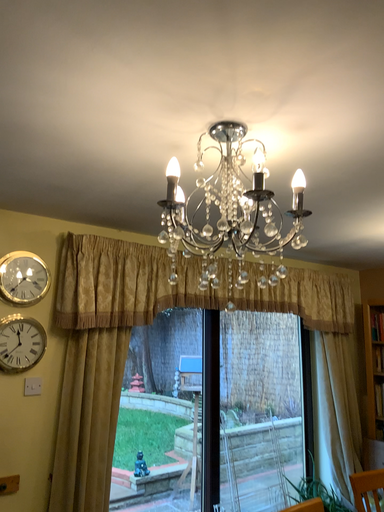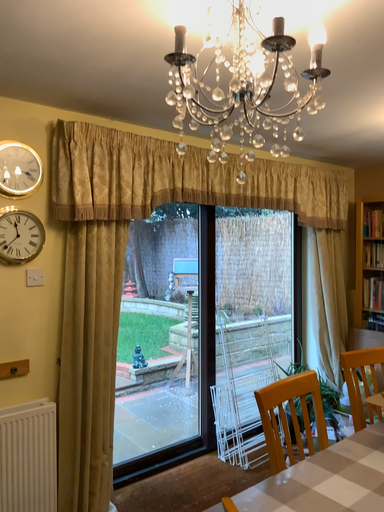
Question: How did the camera likely rotate when shooting the video?

Choices:
 (A) rotated upward
 (B) rotated downward

Answer: (B)